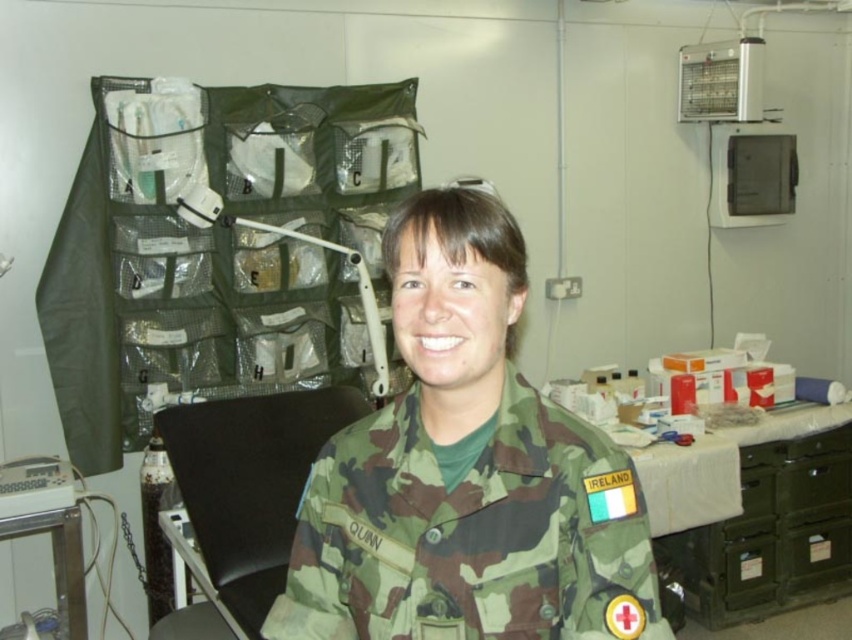
Question: Does camo fabric uniform at center appear on the right side of white plastic monitor at lower left?

Choices:
 (A) no
 (B) yes

Answer: (B)

Question: Which of the following is the closest to the observer?

Choices:
 (A) (20, 468)
 (B) (514, 589)

Answer: (B)

Question: Does camo fabric uniform at center appear over white plastic monitor at lower left?

Choices:
 (A) no
 (B) yes

Answer: (B)

Question: Which object is closer to the camera taking this photo?

Choices:
 (A) white plastic monitor at lower left
 (B) camo fabric uniform at center

Answer: (B)

Question: Which point is closer to the camera?

Choices:
 (A) white plastic monitor at lower left
 (B) camo fabric uniform at center

Answer: (B)

Question: Does camo fabric uniform at center lie behind white plastic monitor at lower left?

Choices:
 (A) yes
 (B) no

Answer: (B)